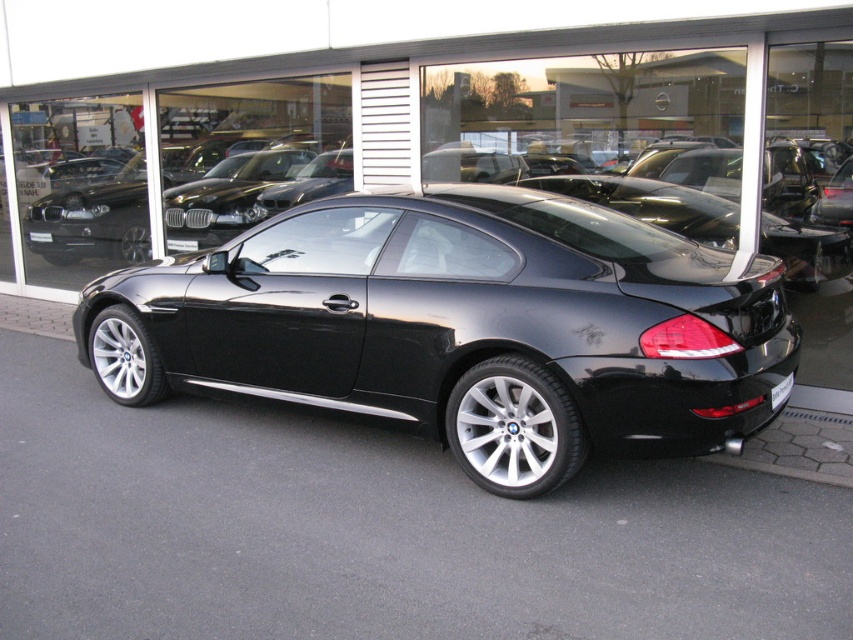
Question: Which object is farther from the camera taking this photo?

Choices:
 (A) black metallic car at center
 (B) white plastic license plate at center
 (C) glossy black car at center
 (D) black plastic license plate at rear

Answer: (B)

Question: Is glossy black car at center above black plastic license plate at rear?

Choices:
 (A) no
 (B) yes

Answer: (B)

Question: Considering the relative positions of black metallic car at center and white plastic license plate at center in the image provided, where is black metallic car at center located with respect to white plastic license plate at center?

Choices:
 (A) above
 (B) below

Answer: (B)

Question: Which object appears closest to the camera in this image?

Choices:
 (A) glossy black car at center
 (B) black plastic license plate at rear
 (C) white plastic license plate at center

Answer: (B)

Question: Which point is closer to the camera?

Choices:
 (A) white plastic license plate at center
 (B) glossy black car at center
 (C) black plastic license plate at rear
 (D) black metallic car at center

Answer: (D)

Question: Does glossy black car at center have a larger size compared to black metallic car at center?

Choices:
 (A) yes
 (B) no

Answer: (A)